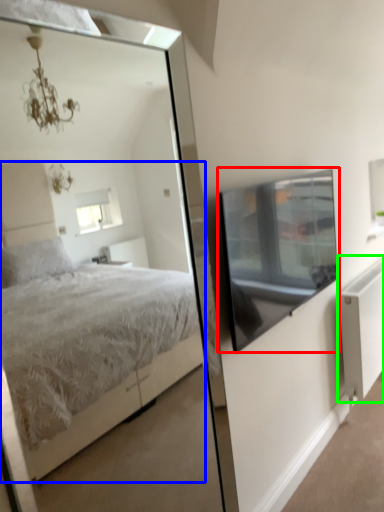
Question: Which is farther away from window screen (highlighted by a red box)? bed (highlighted by a blue box) or radiator (highlighted by a green box)?

Choices:
 (A) bed
 (B) radiator

Answer: (A)